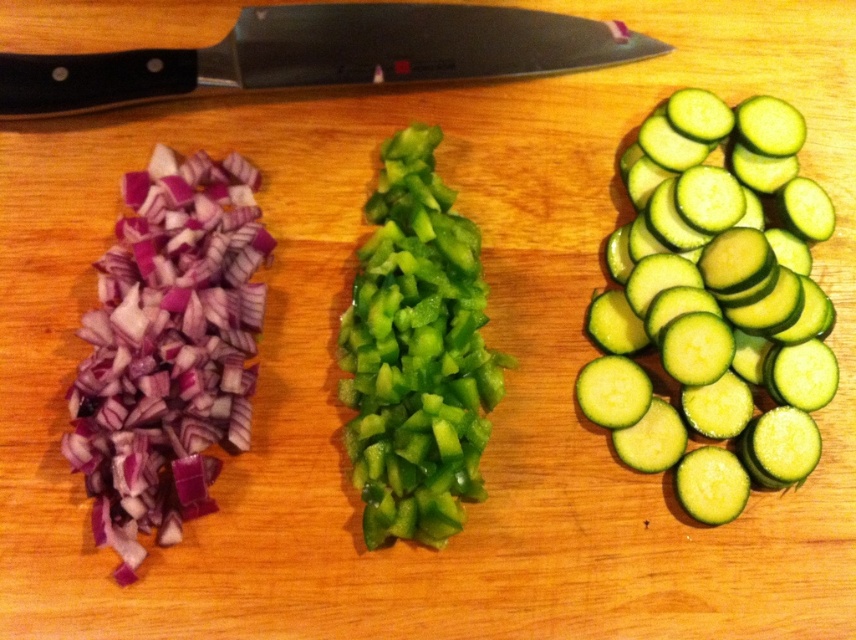
Question: Which object is positioned farthest from the green smooth cucumber at right?

Choices:
 (A) green glossy bell pepper at center
 (B) matte purple onion at left

Answer: (B)

Question: Can you confirm if green smooth cucumber at right is thinner than green glossy bell pepper at center?

Choices:
 (A) yes
 (B) no

Answer: (B)

Question: Can you confirm if green smooth cucumber at right is smaller than black plastic knife at upper center?

Choices:
 (A) yes
 (B) no

Answer: (B)

Question: Which object is positioned farthest from the green smooth cucumber at right?

Choices:
 (A) matte purple onion at left
 (B) green glossy bell pepper at center

Answer: (A)

Question: Which of the following is the closest to the observer?

Choices:
 (A) matte purple onion at left
 (B) green glossy bell pepper at center
 (C) black plastic knife at upper center
 (D) green smooth cucumber at right

Answer: (A)

Question: Is green smooth cucumber at right to the right of green glossy bell pepper at center from the viewer's perspective?

Choices:
 (A) no
 (B) yes

Answer: (B)